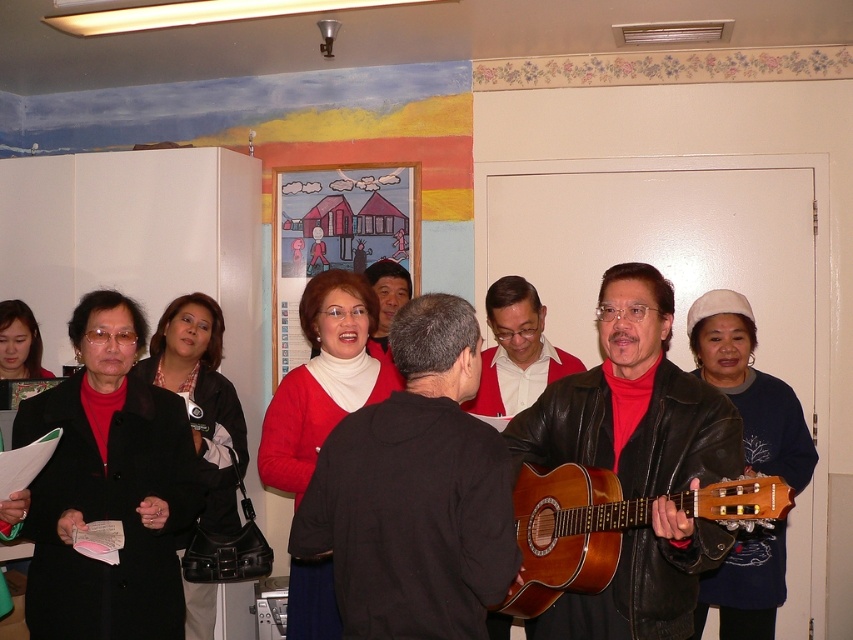
Who is taller, matte black guitar at center or brown wooden guitar at center?

With more height is matte black guitar at center.

What do you see at coordinates (636, 461) in the screenshot?
I see `matte black guitar at center` at bounding box center [636, 461].

Find the location of a particular element. matte black guitar at center is located at coordinates (636, 461).

Where is `matte black guitar at center`? matte black guitar at center is located at coordinates (636, 461).

Does matte black guitar at center have a greater width compared to red matte sweater at center?

→ Indeed, matte black guitar at center has a greater width compared to red matte sweater at center.

Is point (726, 451) in front of point (498, 378)?

Yes, it is.

At what (x,y) coordinates should I click in order to perform the action: click on matte black guitar at center. Please return your answer as a coordinate pair (x, y). Looking at the image, I should click on (636, 461).

Does matte black jacket at center appear over red matte sweater at center?

No, matte black jacket at center is not above red matte sweater at center.

Between matte black jacket at center and red matte sweater at center, which one appears on the left side from the viewer's perspective?

matte black jacket at center

Where is `matte black jacket at center`? This screenshot has height=640, width=853. matte black jacket at center is located at coordinates (415, 492).